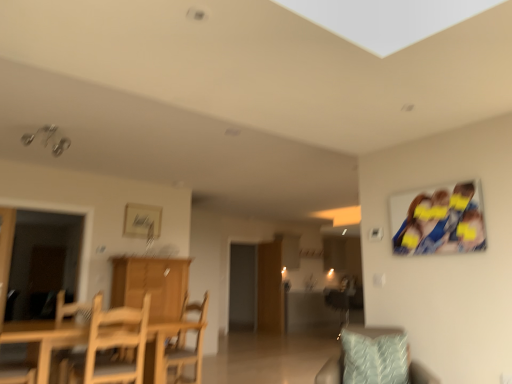
Question: Is wooden chair at lower left spatially inside light wood table at lower left, or outside of it?

Choices:
 (A) inside
 (B) outside

Answer: (A)

Question: From the image's perspective, is wooden chair at lower left positioned above or below light wood table at lower left?

Choices:
 (A) above
 (B) below

Answer: (A)

Question: Which is nearer to the wooden cabinet at center?

Choices:
 (A) wooden chair at center, which is counted as the 4th chair, starting from the front
 (B) transparent glass door at center, the second glass door viewed from the left
 (C) wooden chair at lower left, which ranks as the third chair in right-to-left order
 (D) wooden chair at center, marked as the second chair in a right-to-left arrangement
 (E) wooden chair at lower left, the 1th chair positioned from the front

Answer: (D)

Question: Estimate the real-world distances between objects in this image. Which object is farther from the transparent glass door at center, the second glass door viewed from the left?

Choices:
 (A) blue fabric photo at upper right
 (B) light blue textured pillow at lower right
 (C) wooden chair at lower left, which is counted as the 3th chair, starting from the back
 (D) wooden chair at lower left, which appears as the 1th chair when viewed from the left
 (E) wooden cabinet at center

Answer: (B)